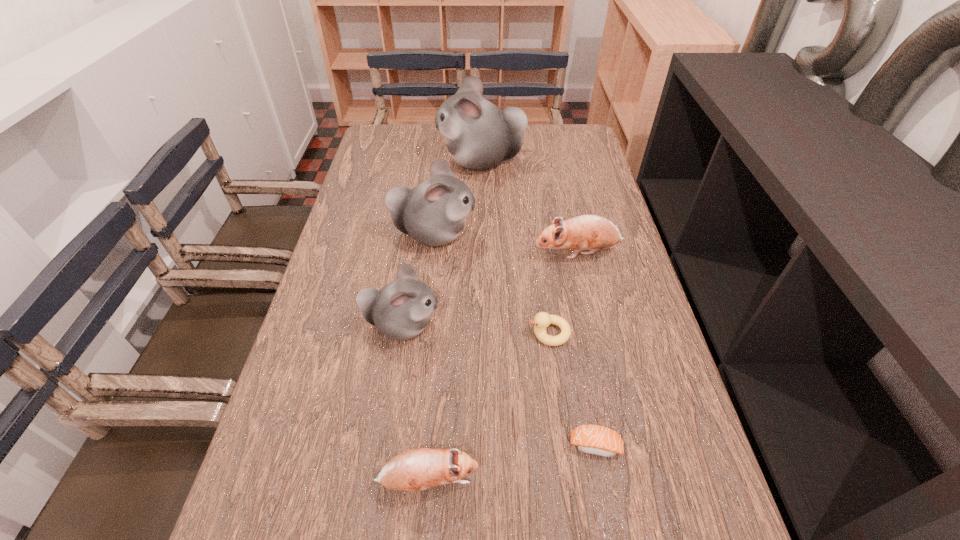
I want to click on free area in between the smaller brown hamster and the duckling, so coord(489,407).

Identify which object is the sixth nearest to the farther brown hamster. Please provide its 2D coordinates. Your answer should be formatted as a tuple, i.e. [(x, y)], where the tuple contains the x and y coordinates of a point satisfying the conditions above.

[(417, 469)]

Where is `object identified as the sixth closest to the duckling`? object identified as the sixth closest to the duckling is located at coordinates (479, 135).

Select which hamster appears as the third closest to the shortest object. Please provide its 2D coordinates. Your answer should be formatted as a tuple, i.e. [(x, y)], where the tuple contains the x and y coordinates of a point satisfying the conditions above.

[(586, 232)]

Image resolution: width=960 pixels, height=540 pixels. What are the coordinates of `the third closest hamster to the second tallest hamster` in the screenshot? It's located at (479, 135).

Identify the location of the third closest white hamster relative to the nearest object. (479, 135).

I want to click on white hamster that can be found as the second closest to the sixth shortest object, so click(x=479, y=135).

The height and width of the screenshot is (540, 960). I want to click on free space in the image that satisfies the following two spatial constraints: 1. on the back side of the shortest object; 2. on the face of the second tallest hamster, so click(x=557, y=235).

Identify the location of free spot that satisfies the following two spatial constraints: 1. on the face of the smallest white hamster; 2. on the back side of the shortest object. This screenshot has height=540, width=960. (384, 445).